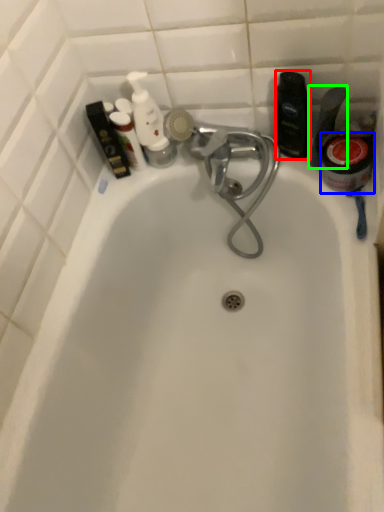
Question: Which is farther away from toiletry (highlighted by a red box)? mouthwash (highlighted by a blue box) or toiletry (highlighted by a green box)?

Choices:
 (A) mouthwash
 (B) toiletry

Answer: (A)